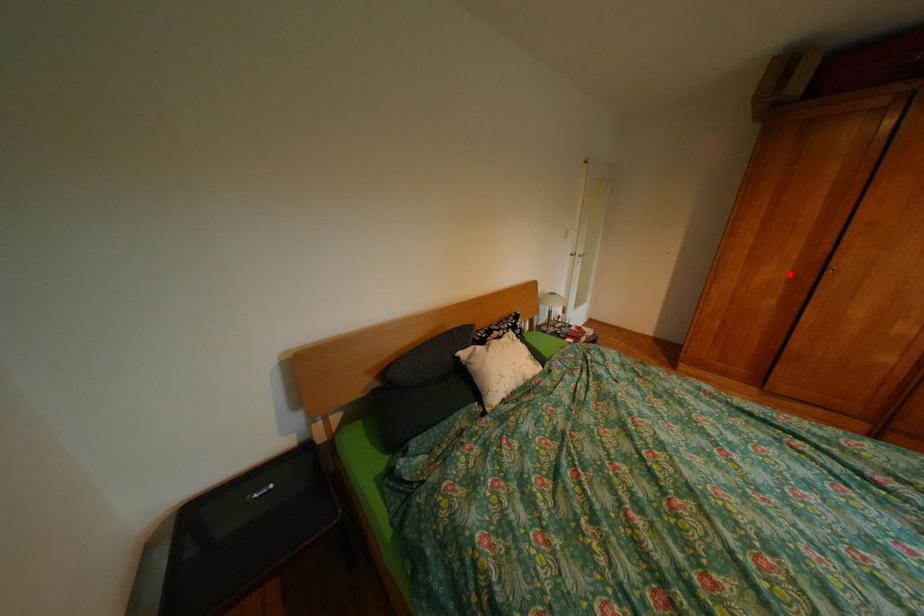
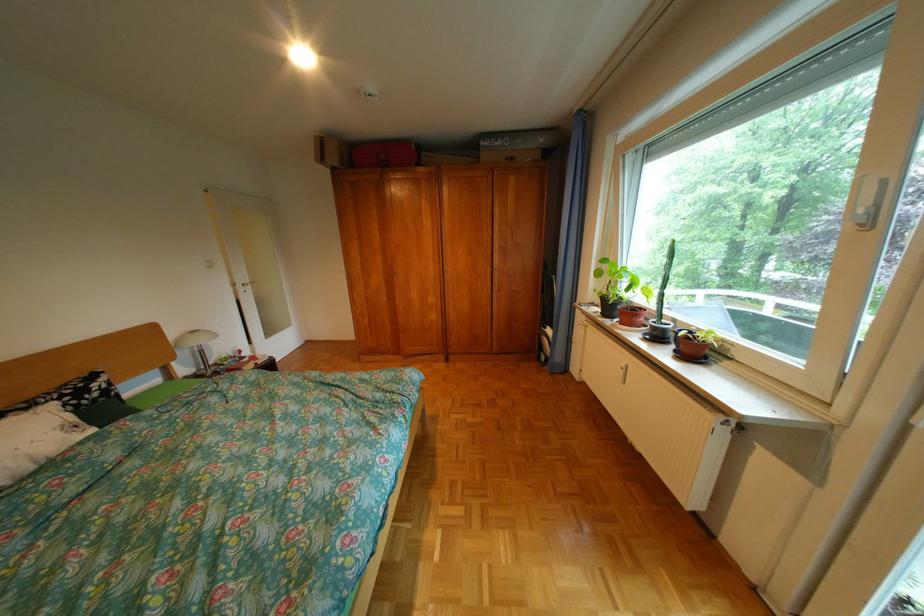
Question: I am providing you with two images of the same scene from different viewpoints. Image1 has a red point marked. In image2, the corresponding 3D location appears at what relative position? Reply with the corresponding letter.

Choices:
 (A) Closer
 (B) Farther

Answer: (A)